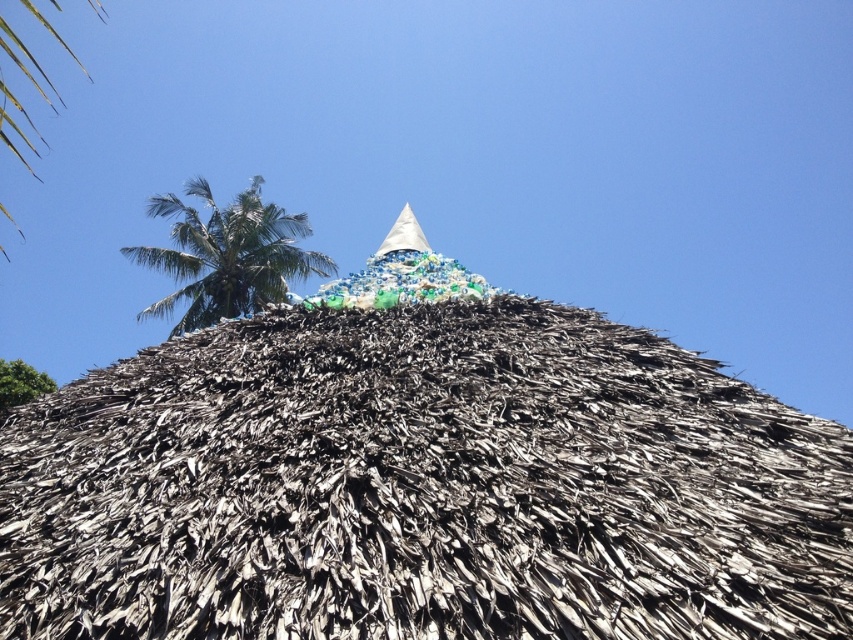
Is point (367, 461) positioned behind point (263, 289)?

No, it is in front of (263, 289).

Can you confirm if brown thatch roof at center is positioned above green leafy palm tree at upper left?

No, brown thatch roof at center is not above green leafy palm tree at upper left.

You are a GUI agent. You are given a task and a screenshot of the screen. Output one action in this format:
    pyautogui.click(x=<x>, y=<y>)
    Task: Click on the brown thatch roof at center
    This screenshot has width=853, height=640.
    Given the screenshot: What is the action you would take?
    tap(422, 486)